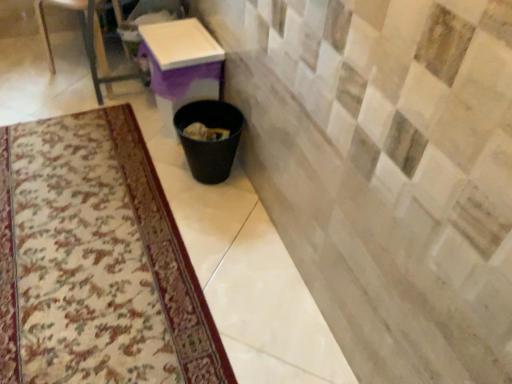
The height and width of the screenshot is (384, 512). I want to click on vacant space in front of metallic glass table at upper left, so [65, 120].